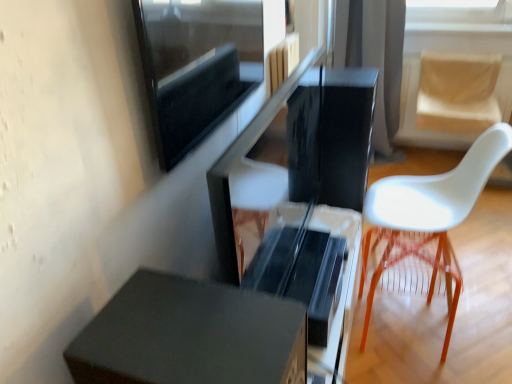
At what (x,y) coordinates should I click in order to perform the action: click on free space in front of white plastic chair at right. Please return your answer as a coordinate pair (x, y). The image size is (512, 384). Looking at the image, I should click on (454, 352).